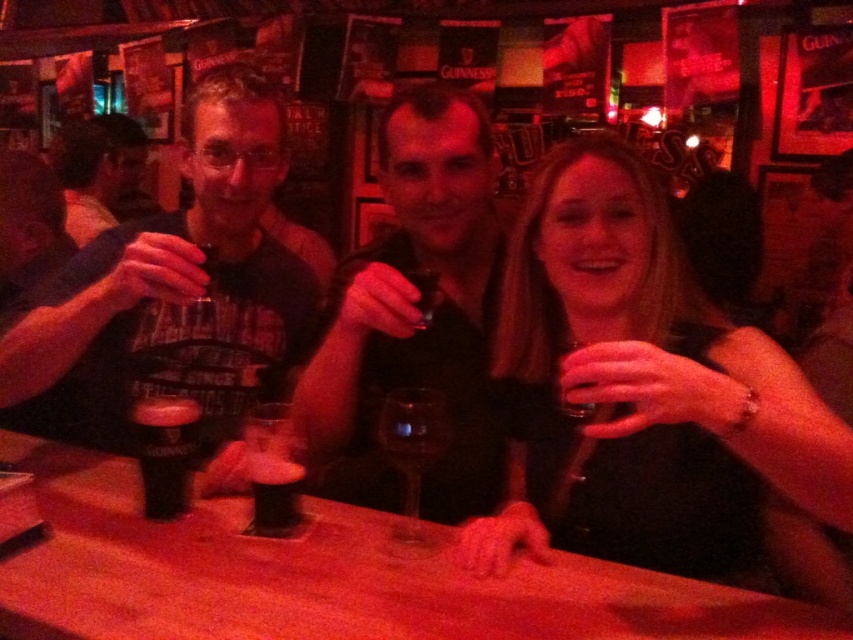
Question: Which point appears closest to the camera in this image?

Choices:
 (A) (438, 428)
 (B) (459, 605)
 (C) (167, 452)

Answer: (B)

Question: Does smooth black wine glass at center appear on the left side of transparent glass at center?

Choices:
 (A) yes
 (B) no

Answer: (B)

Question: Can you confirm if transparent glass wine at center is positioned above transparent glass at center?

Choices:
 (A) no
 (B) yes

Answer: (A)

Question: Which point is closer to the camera?

Choices:
 (A) (399, 452)
 (B) (292, 522)

Answer: (A)

Question: Considering the real-world distances, which object is closest to the smooth black wine glass at center?

Choices:
 (A) dark brown glass at center
 (B) matte black t-shirt at center

Answer: (A)

Question: Does smooth black wine glass at center appear on the left side of dark brown glass at center?

Choices:
 (A) no
 (B) yes

Answer: (A)